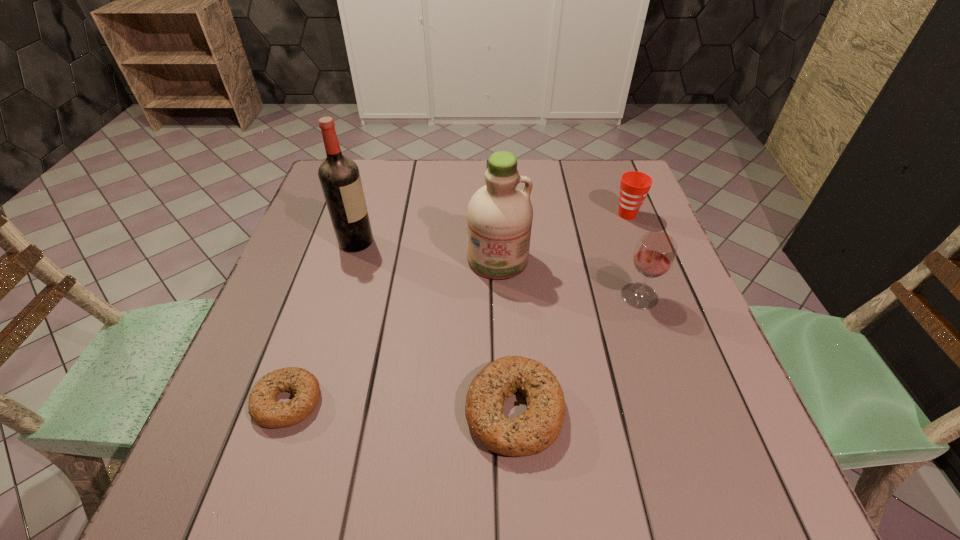
Image resolution: width=960 pixels, height=540 pixels. Find the location of `vacant region between the taller bagel and the third shortest object`. vacant region between the taller bagel and the third shortest object is located at coordinates coord(570,313).

Identify the location of free space that is in between the liquor and the second shortest object. This screenshot has height=540, width=960. (435, 326).

Find the location of a particular element. free space between the farthest object and the second shortest object is located at coordinates (570, 313).

Locate an element on the screen. The image size is (960, 540). free space between the cleansing agent and the farthest object is located at coordinates (563, 237).

The width and height of the screenshot is (960, 540). In order to click on free space between the wineglass and the cleansing agent in this screenshot , I will do `click(568, 278)`.

Locate an element on the screen. The image size is (960, 540). free space between the left bagel and the second tallest object is located at coordinates (393, 330).

Where is `free space between the farthest object and the second tallest object`? free space between the farthest object and the second tallest object is located at coordinates (563, 237).

You are a GUI agent. You are given a task and a screenshot of the screen. Output one action in this format:
    pyautogui.click(x=<x>, y=<y>)
    Task: Click on the unoccupied position between the liquor and the fifth shortest object
    
    Given the screenshot: What is the action you would take?
    pyautogui.click(x=427, y=251)

Identify which object is the third closest to the third nearest object. Please provide its 2D coordinates. Your answer should be formatted as a tuple, i.e. [(x, y)], where the tuple contains the x and y coordinates of a point satisfying the conditions above.

[(535, 430)]

Locate which object is the fifth closest to the liquor. Please provide its 2D coordinates. Your answer should be formatted as a tuple, i.e. [(x, y)], where the tuple contains the x and y coordinates of a point satisfying the conditions above.

[(634, 186)]